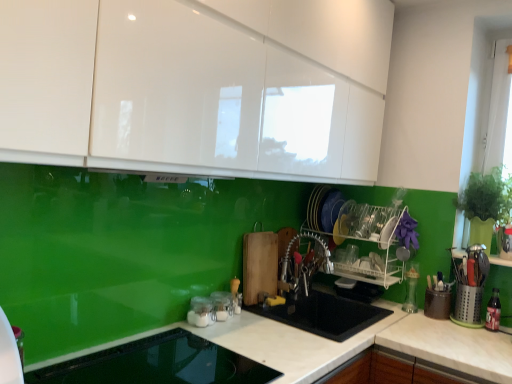
Where is `empty space that is to the right of clear glass jars at lower center, arranged as the 5th appliance when viewed from the right`? Image resolution: width=512 pixels, height=384 pixels. empty space that is to the right of clear glass jars at lower center, arranged as the 5th appliance when viewed from the right is located at coordinates (244, 328).